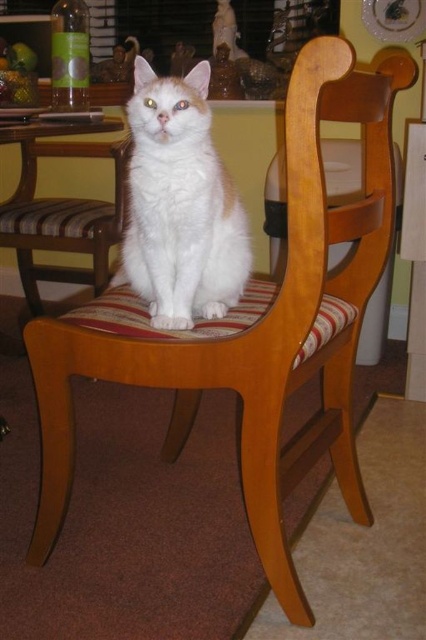
Which of these two, white fluffy cat at center or wooden chair at center, stands taller?

wooden chair at center is taller.

Does white fluffy cat at center have a lesser height compared to wooden chair at center?

Yes.

Find the location of a particular element. This screenshot has width=426, height=640. white fluffy cat at center is located at coordinates (180, 204).